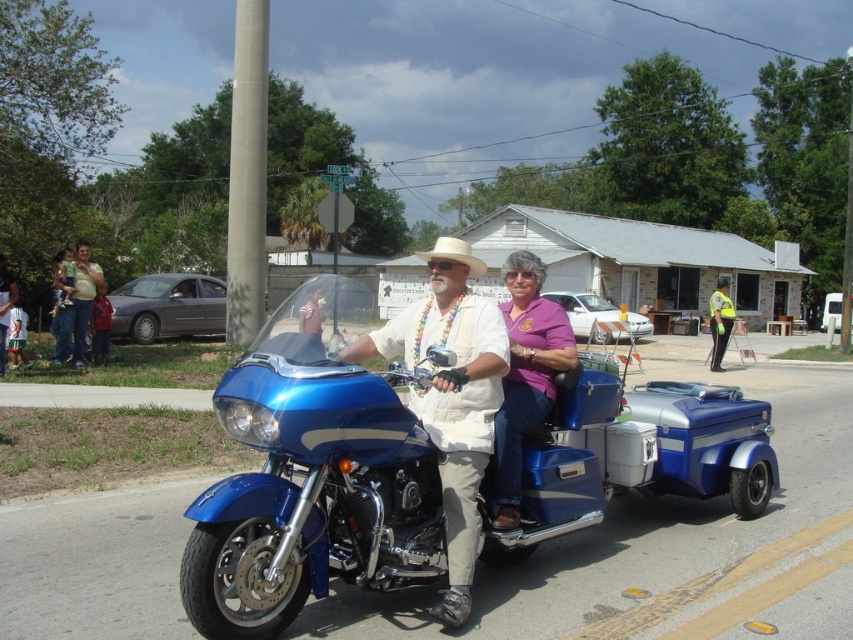
Question: Is matte white shirt at center positioned behind white straw cowboy hat at center?

Choices:
 (A) no
 (B) yes

Answer: (B)

Question: Does blue metallic sidecar at lower right appear on the right side of reflective yellow vest at right?

Choices:
 (A) yes
 (B) no

Answer: (B)

Question: Is purple matte shirt at center bigger than reflective yellow vest at right?

Choices:
 (A) yes
 (B) no

Answer: (B)

Question: Estimate the real-world distances between objects in this image. Which object is closer to the shiny blue motorcycle at center?

Choices:
 (A) reflective yellow vest at right
 (B) metallic blue motorcycle at center
 (C) blue metallic sidecar at lower right

Answer: (B)

Question: Which point appears closest to the camera in this image?

Choices:
 (A) (291, 468)
 (B) (80, 344)

Answer: (A)

Question: Among these objects, which one is nearest to the camera?

Choices:
 (A) metallic blue motorcycle at center
 (B) blue metallic sidecar at lower right
 (C) reflective yellow vest at right
 (D) purple matte shirt at center

Answer: (A)